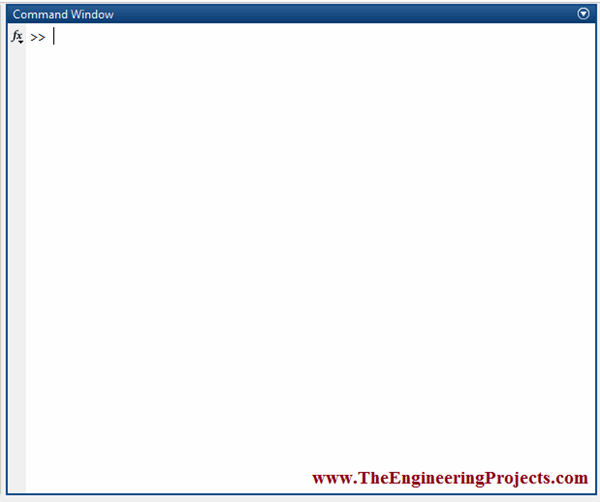
Locate an element on the screen. The image size is (600, 502). window is located at coordinates (107, 13).